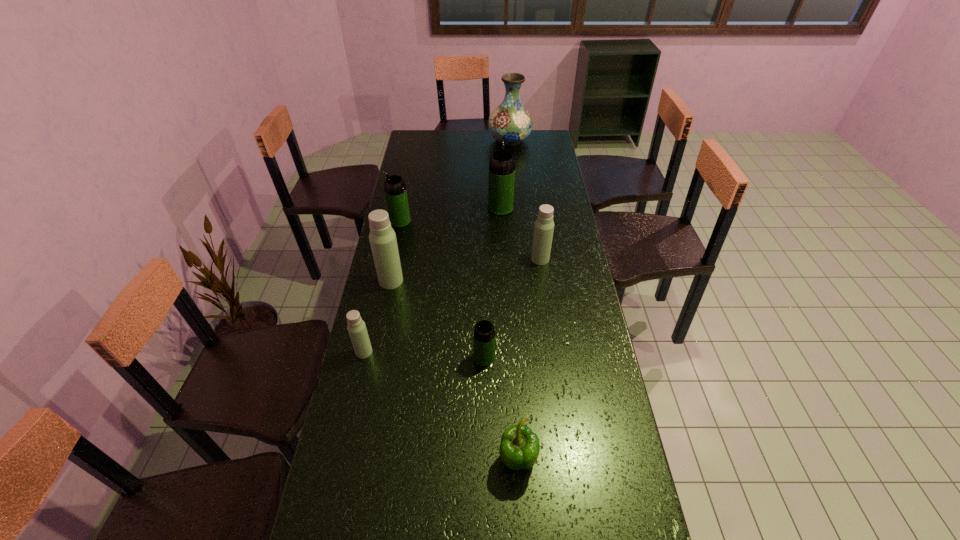
Image resolution: width=960 pixels, height=540 pixels. Identify the location of bell pepper. (519, 449).

I want to click on the nearest object, so click(519, 449).

Identify the location of free point located 0.140m on the left of the farthest object. The image size is (960, 540). (462, 140).

You are a GUI agent. You are given a task and a screenshot of the screen. Output one action in this format:
    pyautogui.click(x=<x>, y=<y>)
    Task: Click on the free space located from the spout of the biggest green thermos bottle
    
    Given the screenshot: What is the action you would take?
    pyautogui.click(x=498, y=174)

Image resolution: width=960 pixels, height=540 pixels. What are the coordinates of `free spot located 0.280m from the spout of the biggest green thermos bottle` in the screenshot? It's located at (498, 167).

I want to click on free space located 0.110m from the spout of the biggest green thermos bottle, so click(499, 187).

Where is `free point located on the back of the biggest light thermos bottle`? This screenshot has height=540, width=960. free point located on the back of the biggest light thermos bottle is located at coordinates (395, 264).

You are a GUI agent. You are given a task and a screenshot of the screen. Output one action in this format:
    pyautogui.click(x=<x>, y=<y>)
    Task: Click on the vacant position located on the back of the second smallest light thermos bottle
    Image resolution: width=960 pixels, height=540 pixels.
    Given the screenshot: What is the action you would take?
    pyautogui.click(x=534, y=211)

Identify the location of free region located 0.290m from the spout of the smallest green thermos bottle. (380, 357).

You are a GUI agent. You are given a task and a screenshot of the screen. Output one action in this format:
    pyautogui.click(x=<x>, y=<y>)
    Task: Click on the vacant space situated 0.260m from the spout of the smallest green thermos bottle
    
    Given the screenshot: What is the action you would take?
    pyautogui.click(x=390, y=357)